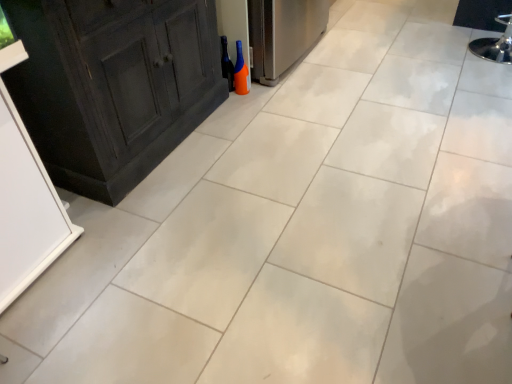
Find the location of a particular element. free space in front of black glass wine bottle at center is located at coordinates (231, 95).